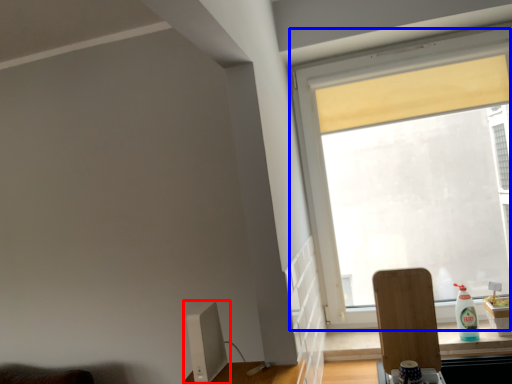
Question: Among these objects, which one is nearest to the camera, computer monitor (highlighted by a red box) or window (highlighted by a blue box)?

Choices:
 (A) computer monitor
 (B) window

Answer: (A)